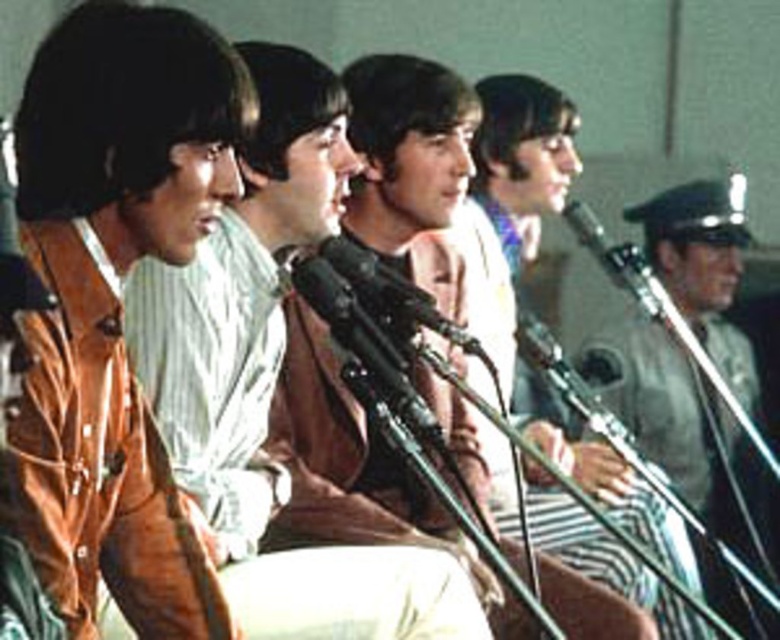
Is gray uniform at right taller than metallic silver microphone at center?

Yes, gray uniform at right is taller than metallic silver microphone at center.

Is gray uniform at right above metallic silver microphone at center?

Actually, gray uniform at right is below metallic silver microphone at center.

Between point (651, 266) and point (594, 218), which one is positioned in front?

Positioned in front is point (594, 218).

At what (x,y) coordinates should I click in order to perform the action: click on gray uniform at right. Please return your answer as a coordinate pair (x, y). This screenshot has width=780, height=640. Looking at the image, I should click on (679, 422).

What are the coordinates of `black metallic microphone at center` in the screenshot? It's located at (392, 292).

Is black metallic microphone at center to the left of metallic silver microphone at center from the viewer's perspective?

Yes, black metallic microphone at center is to the left of metallic silver microphone at center.

Which is in front, point (332, 246) or point (587, 236)?

Point (332, 246) is in front.

Where is `black metallic microphone at center`? black metallic microphone at center is located at coordinates (392, 292).

Between gray uniform at right and black metallic microphone at center, which one is positioned higher?

black metallic microphone at center is above.

Between point (658, 342) and point (473, 349), which one is positioned behind?

Positioned behind is point (658, 342).

Is point (685, 321) more distant than point (445, 333)?

Yes, it is behind point (445, 333).

Identify the location of gray uniform at right. (679, 422).